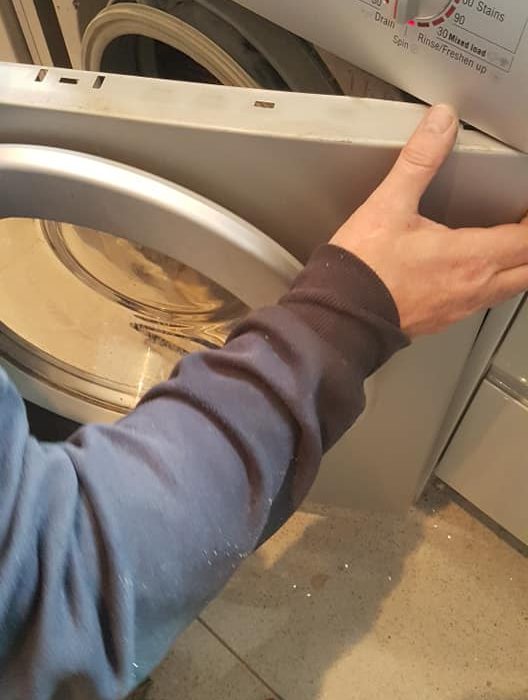
The image size is (528, 700). What are the coordinates of `washer tub` in the screenshot? It's located at (169, 66).